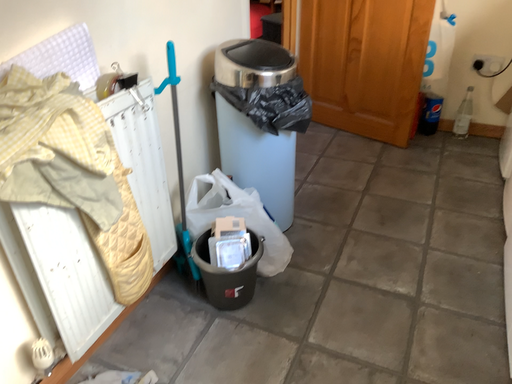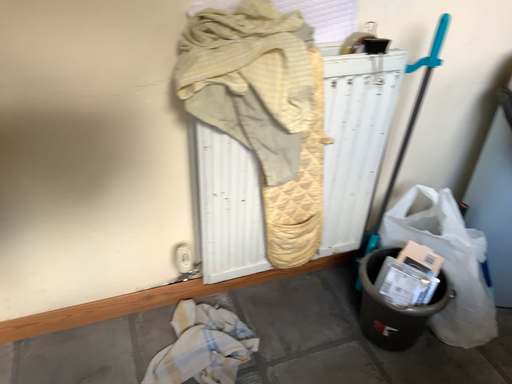
Question: Which way did the camera rotate in the video?

Choices:
 (A) rotated left
 (B) rotated right

Answer: (A)